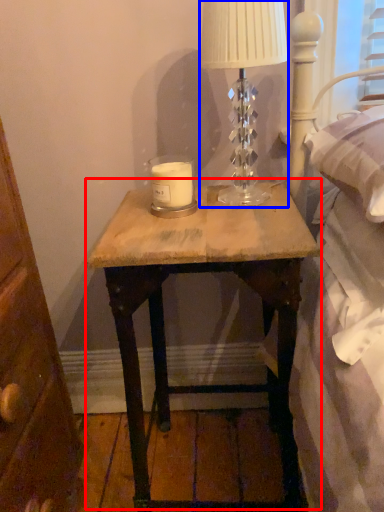
Question: Which of the following is the closest to the observer, nightstand (highlighted by a red box) or table lamp (highlighted by a blue box)?

Choices:
 (A) nightstand
 (B) table lamp

Answer: (A)